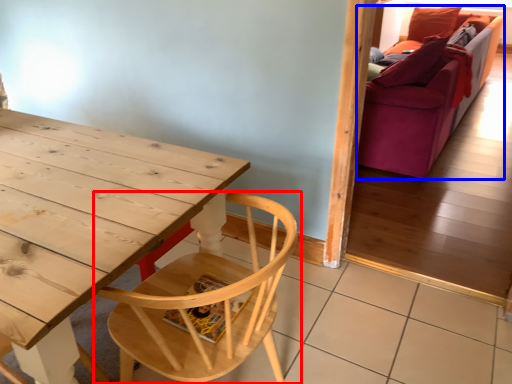
Question: Among these objects, which one is farthest to the camera, chair (highlighted by a red box) or studio couch (highlighted by a blue box)?

Choices:
 (A) chair
 (B) studio couch

Answer: (B)